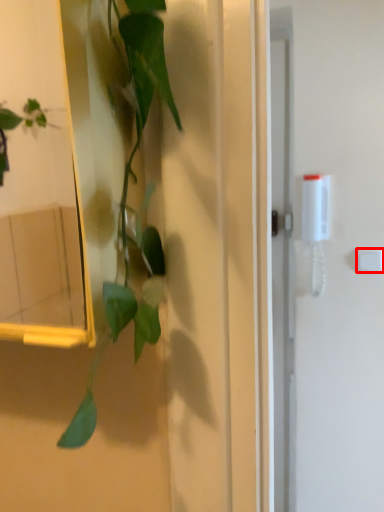
Question: Where is light switch (annotated by the red box) located in relation to houseplant in the image?

Choices:
 (A) left
 (B) right

Answer: (B)